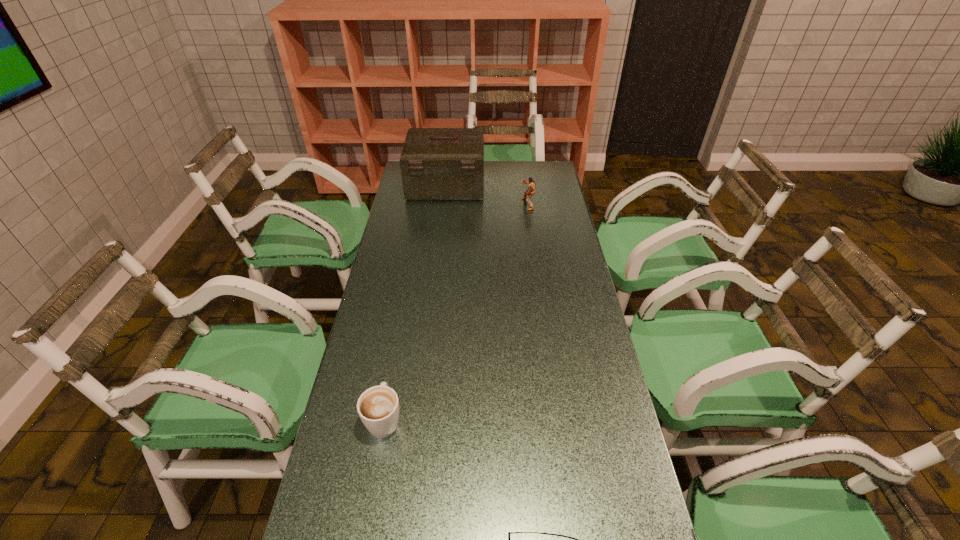
This screenshot has width=960, height=540. I want to click on empty location between the tallest object and the cappuccino, so click(x=415, y=302).

Identify the location of unoccupied area between the second shortest object and the third shortest object. Image resolution: width=960 pixels, height=540 pixels. (456, 312).

The image size is (960, 540). Identify the location of empty space between the third shortest object and the second nearest object. (456, 312).

The height and width of the screenshot is (540, 960). In order to click on object that is the closest to the cappuccino in this screenshot , I will do tap(509, 533).

Select which object appears as the third closest to the tallest object. Please provide its 2D coordinates. Your answer should be formatted as a tuple, i.e. [(x, y)], where the tuple contains the x and y coordinates of a point satisfying the conditions above.

[(509, 533)]

Where is `vacant space that satisfies the following two spatial constraints: 1. with the handle on the side of the second shortest object; 2. on the left side of the first-aid kit`? The height and width of the screenshot is (540, 960). vacant space that satisfies the following two spatial constraints: 1. with the handle on the side of the second shortest object; 2. on the left side of the first-aid kit is located at coordinates (426, 185).